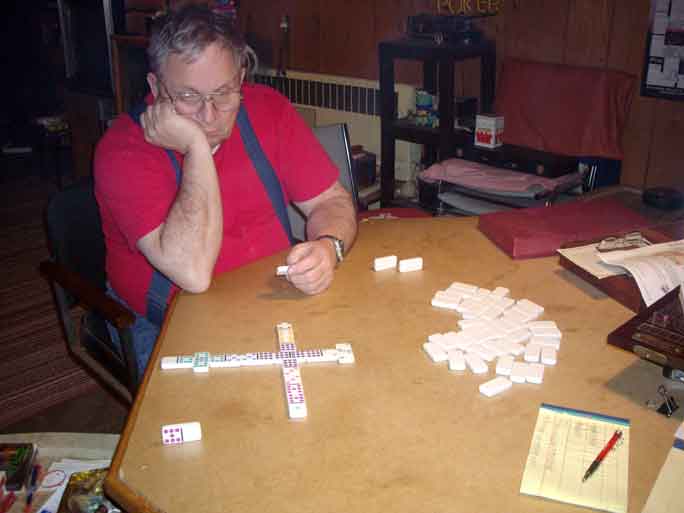
Where is `back walls`? This screenshot has height=513, width=684. back walls is located at coordinates (351, 38).